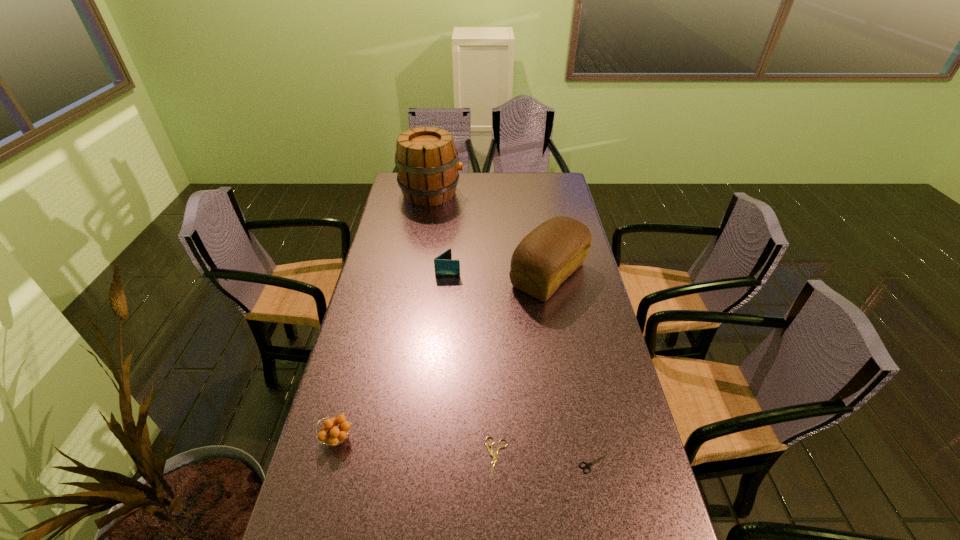
This screenshot has width=960, height=540. Find the location of `cider`. cider is located at coordinates (427, 163).

The height and width of the screenshot is (540, 960). In order to click on the farthest object in this screenshot , I will do `click(427, 163)`.

Locate an element on the screen. This screenshot has height=540, width=960. bread is located at coordinates (548, 255).

Where is `the fourth shortest object`? the fourth shortest object is located at coordinates (444, 265).

I want to click on the fourth tallest object, so click(x=338, y=434).

Locate an element on the screen. the third object from right to left is located at coordinates (494, 455).

Identify the location of the right shears. (587, 465).

The width and height of the screenshot is (960, 540). I want to click on vacant region located 0.200m on the side of the cider where the spigot is located, so click(507, 193).

This screenshot has width=960, height=540. I want to click on vacant region located 0.060m on the back of the second tallest object, so click(542, 239).

The width and height of the screenshot is (960, 540). Find the location of `free space located 0.390m on the exterior surface of the third tallest object`. free space located 0.390m on the exterior surface of the third tallest object is located at coordinates (566, 270).